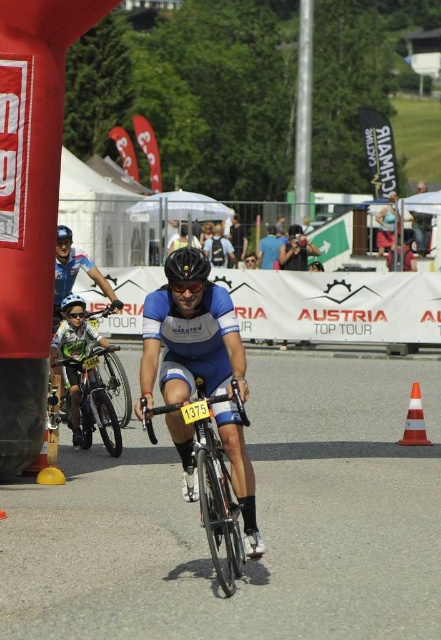
Question: Can you confirm if green matte bicycle at left is positioned below orange reflective cone at lower right?

Choices:
 (A) no
 (B) yes

Answer: (A)

Question: Which point is farther from the camera taking this photo?

Choices:
 (A) (85, 426)
 (B) (201, 522)
 (C) (189, 257)

Answer: (A)

Question: Which of the following is the closest to the observer?

Choices:
 (A) (116, 452)
 (B) (74, 298)
 (C) (228, 593)
 (D) (414, 444)

Answer: (C)

Question: Is shiny metallic bicycle at center to the right of black matte bicycle helmet at center from the viewer's perspective?

Choices:
 (A) yes
 (B) no

Answer: (A)

Question: Among these objects, which one is nearest to the camera?

Choices:
 (A) black matte bicycle helmet at center
 (B) matte black helmet at center
 (C) green matte bicycle at left
 (D) shiny metallic bicycle at center

Answer: (D)

Question: In this image, where is green matte bicycle at left located relative to orange reflective cone at lower right?

Choices:
 (A) below
 (B) above

Answer: (B)